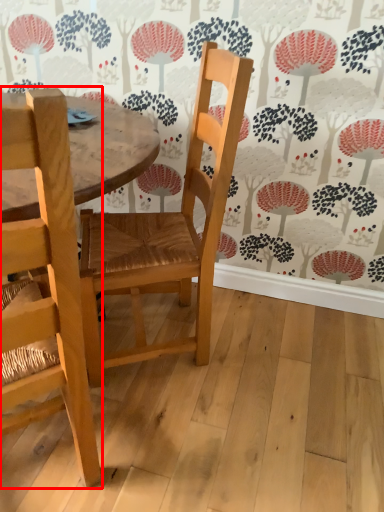
Question: In this image, where is chair (annotated by the red box) located relative to chair?

Choices:
 (A) left
 (B) right

Answer: (A)